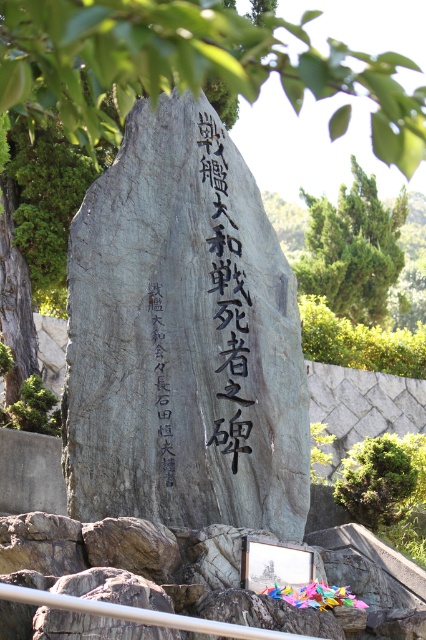
Question: Which object is the farthest from the green textured pine tree at upper right?

Choices:
 (A) black stone inscription at center
 (B) gray stone monument at center

Answer: (A)

Question: Which object appears closest to the camera in this image?

Choices:
 (A) gray stone monument at center
 (B) black stone inscription at center

Answer: (A)

Question: In this image, where is green mossy rock at upper center located relative to green textured pine tree at upper right?

Choices:
 (A) right
 (B) left

Answer: (B)

Question: Estimate the real-world distances between objects in this image. Which object is closer to the metal rail at lower center?

Choices:
 (A) black stone inscription at center
 (B) green mossy rock at upper center
 (C) green textured pine tree at upper right
 (D) green leafy tree at upper left

Answer: (A)

Question: Is green mossy rock at upper center behind green textured pine tree at upper right?

Choices:
 (A) yes
 (B) no

Answer: (B)

Question: Is metal rail at lower center bigger than black stone inscription at center?

Choices:
 (A) yes
 (B) no

Answer: (B)